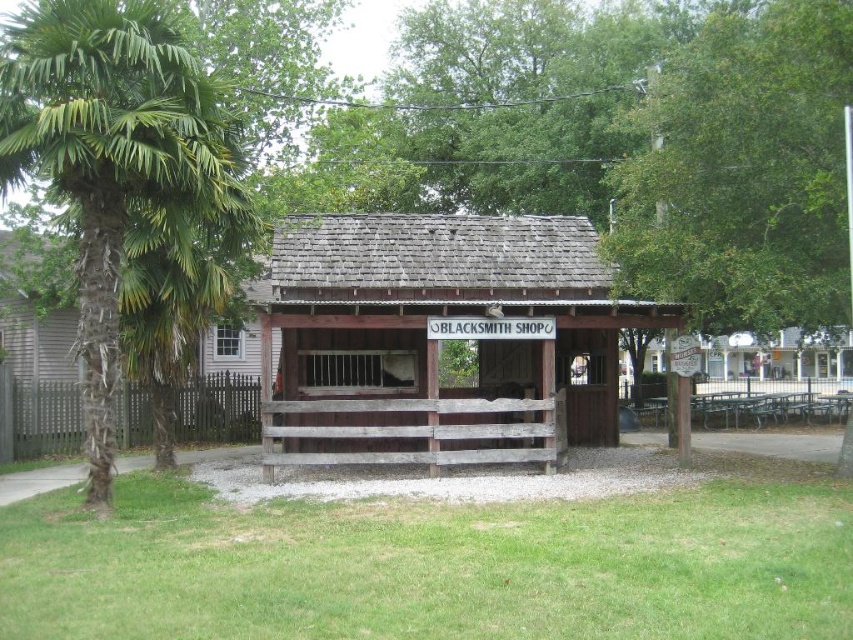
Does weathered wood/blacksmith shop at center have a lesser width compared to green leafy palm tree at left?

Yes, weathered wood/blacksmith shop at center is thinner than green leafy palm tree at left.

Between point (601, 376) and point (138, 86), which one is positioned behind?

The point (601, 376) is behind.

Is point (593, 285) farther from camera compared to point (86, 355)?

Yes, it is behind point (86, 355).

You are a GUI agent. You are given a task and a screenshot of the screen. Output one action in this format:
    pyautogui.click(x=<x>, y=<y>)
    Task: Click on the weathered wood/blacksmith shop at center
    The image size is (853, 640).
    Given the screenshot: What is the action you would take?
    pyautogui.click(x=439, y=339)